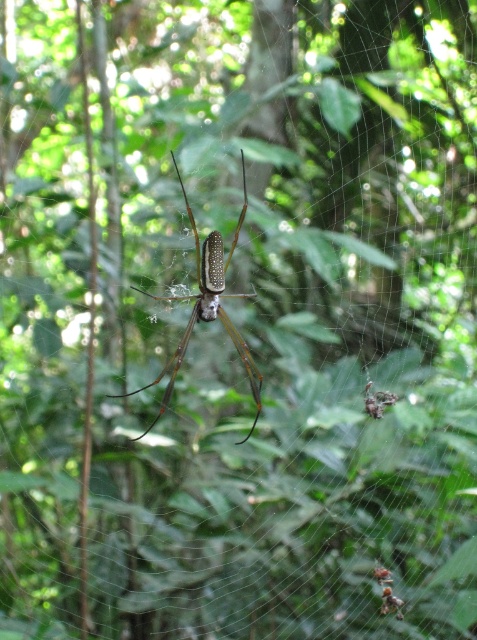
Question: Is shiny brown spider at center positioned in front of translucent silk orb at center?

Choices:
 (A) yes
 (B) no

Answer: (A)

Question: Considering the real-world distances, which object is farthest from the shiny brown spider at center?

Choices:
 (A) shiny metallic spider at center
 (B) translucent silk orb at center

Answer: (B)

Question: Can you confirm if shiny brown spider at center is wider than shiny metallic spider at center?

Choices:
 (A) yes
 (B) no

Answer: (A)

Question: Which object appears closest to the camera in this image?

Choices:
 (A) shiny brown spider at center
 (B) translucent silk orb at center
 (C) shiny metallic spider at center

Answer: (A)

Question: Based on their relative distances, which object is nearer to the translucent silk orb at center?

Choices:
 (A) shiny brown spider at center
 (B) shiny metallic spider at center

Answer: (B)

Question: Does shiny brown spider at center appear over shiny metallic spider at center?

Choices:
 (A) yes
 (B) no

Answer: (A)